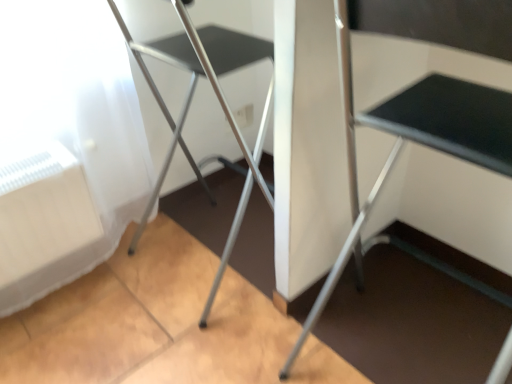
What are the coordinates of `free spot to the left of metallic silver chair at left` in the screenshot? It's located at (88, 302).